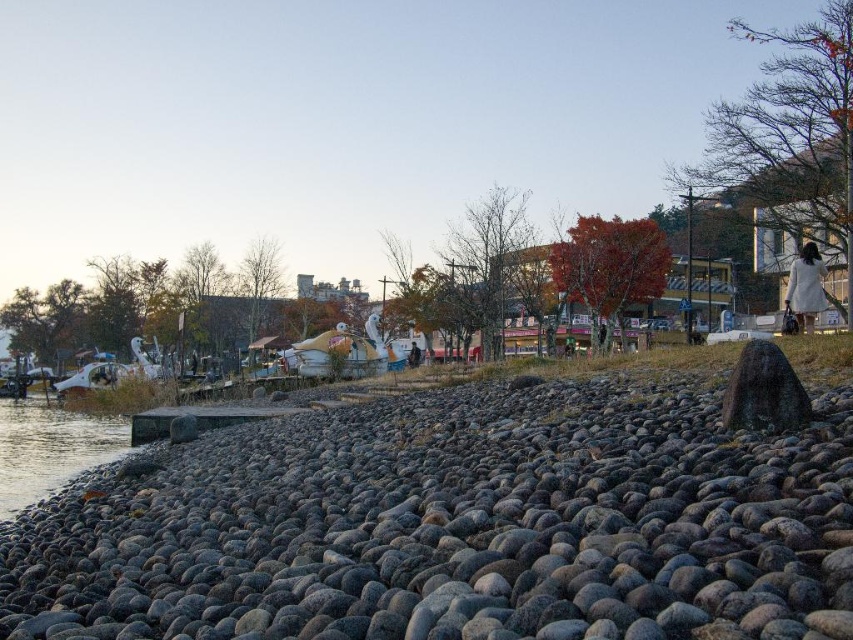
Between gray smooth rock at center and white cotton dress at right, which one is positioned lower?

Positioned lower is gray smooth rock at center.

Is gray smooth rock at center to the right of white cotton dress at right from the viewer's perspective?

No, gray smooth rock at center is not to the right of white cotton dress at right.

I want to click on gray smooth rock at center, so click(456, 525).

Is point (50, 449) closer to viewer compared to point (808, 250)?

No, it is behind (808, 250).

Between point (24, 460) and point (801, 308), which one is positioned behind?

The point (24, 460) is more distant.

Locate an element on the screen. The width and height of the screenshot is (853, 640). clear water at lower left is located at coordinates (50, 449).

Which is in front, point (730, 448) or point (90, 456)?

Positioned in front is point (730, 448).

Does gray smooth rock at center appear under clear water at lower left?

No.

Which is in front, point (457, 488) or point (18, 483)?

Positioned in front is point (457, 488).

At what (x,y) coordinates should I click in order to perform the action: click on gray smooth rock at center. Please return your answer as a coordinate pair (x, y). This screenshot has height=640, width=853. Looking at the image, I should click on (456, 525).